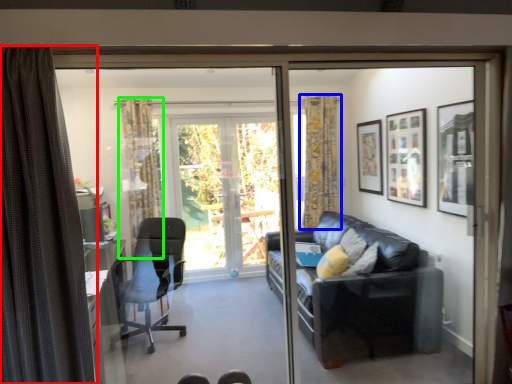
Question: Which object is positioned farthest from curtain (highlighted by a red box)? Select from curtain (highlighted by a blue box) and curtain (highlighted by a green box).

Choices:
 (A) curtain
 (B) curtain

Answer: (A)